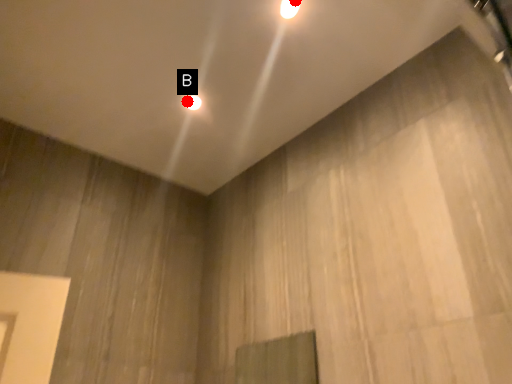
Question: Two points are circled on the image, labeled by A and B beside each circle. Among these points, which one is nearest to the camera?

Choices:
 (A) A is closer
 (B) B is closer

Answer: (A)